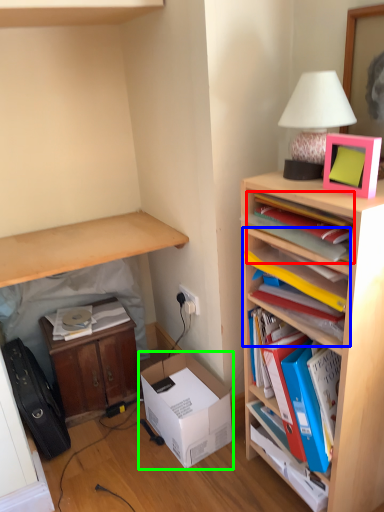
Question: Which object is the closest to the book (highlighted by a red box)? Choose among these: shelf (highlighted by a blue box) or box (highlighted by a green box).

Choices:
 (A) shelf
 (B) box

Answer: (A)